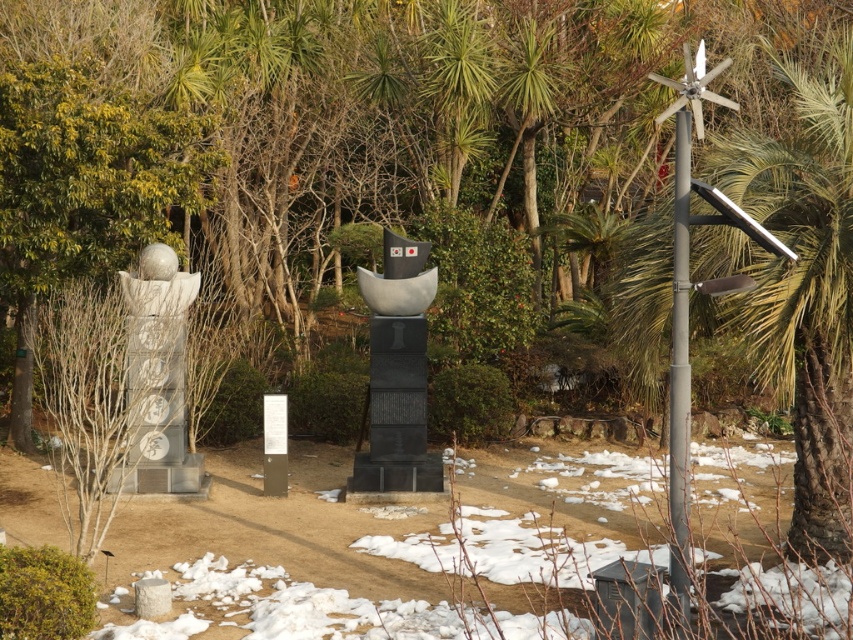
You are standing in the snowy garden and want to take a photo of the green leafy palm tree at right and the white stone statue at left. Which object will appear larger in your photo?

The green leafy palm tree at right will appear larger in the photo because it is closer to the viewer than the white stone statue at left.

You are standing in the snowy garden and want to take a photo of both the green leafy palm tree at right and the white stone statue at left. Which object should you adjust your camera angle to include first if they are not both in frame?

The green leafy palm tree at right is positioned over the white stone statue at left, so you should adjust your camera angle to include the white stone statue at left first as it is behind the palm tree.